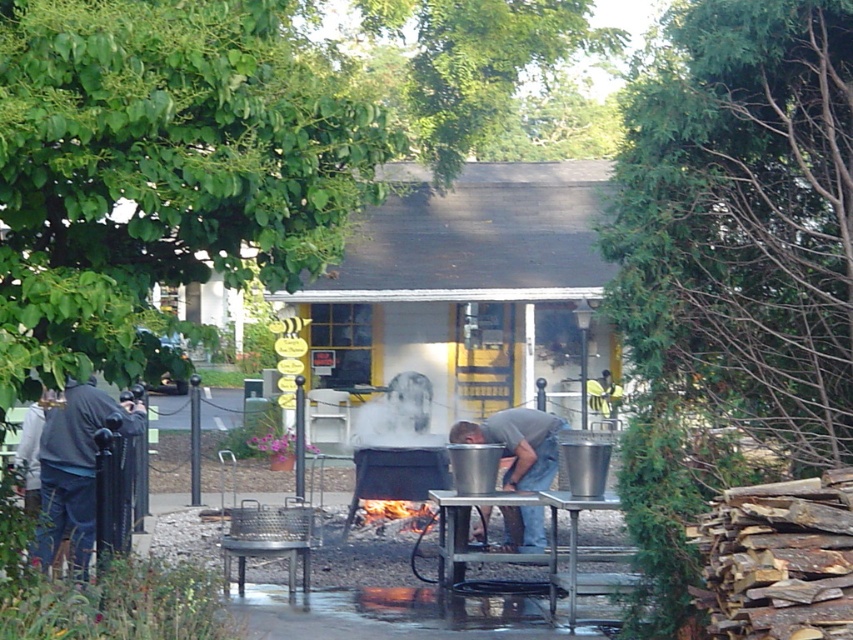
You are a chef standing near the cooking area and notice both the gray matte shirt at center and the white foggy steam at center. Which object is bigger in size?

The gray matte shirt at center has a larger size compared to the white foggy steam at center.